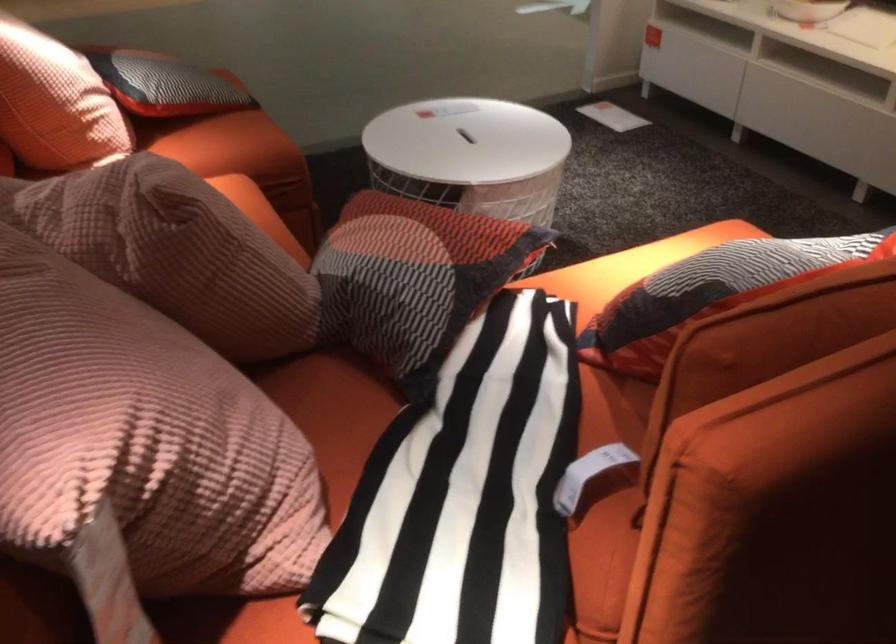
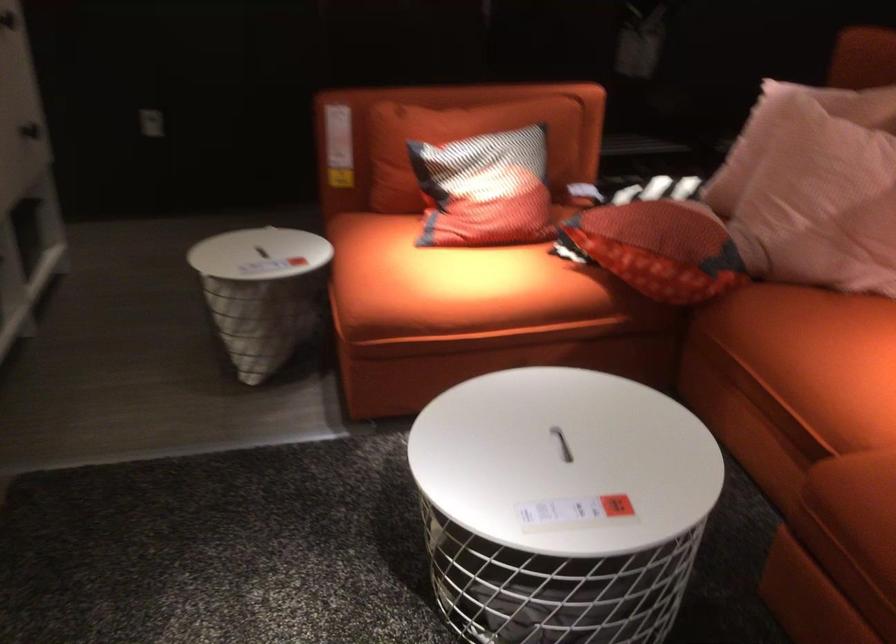
Find the pixel in the second image that matches pixel 452 146 in the first image.

(562, 444)